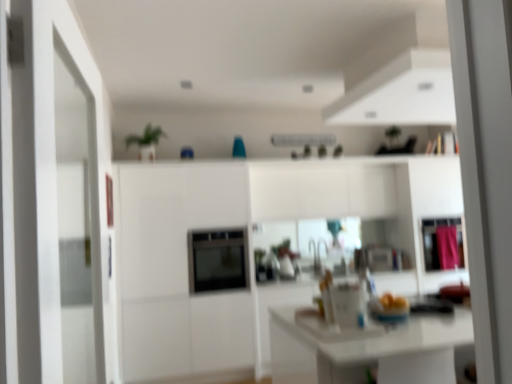
Question: Does satin black oven at center have a smaller size compared to pink fabric curtain at right?

Choices:
 (A) yes
 (B) no

Answer: (B)

Question: From the image's perspective, would you say satin black oven at center is shown under pink fabric curtain at right?

Choices:
 (A) yes
 (B) no

Answer: (A)

Question: Is satin black oven at center positioned behind pink fabric curtain at right?

Choices:
 (A) yes
 (B) no

Answer: (B)

Question: Does satin black oven at center have a lesser width compared to pink fabric curtain at right?

Choices:
 (A) yes
 (B) no

Answer: (B)

Question: Is satin black oven at center positioned before pink fabric curtain at right?

Choices:
 (A) no
 (B) yes

Answer: (B)

Question: From a real-world perspective, is satin black oven at center positioned over pink fabric curtain at right based on gravity?

Choices:
 (A) yes
 (B) no

Answer: (A)

Question: Considering the relative sizes of satin black oven at center and pink fabric cabinet at right in the image provided, is satin black oven at center wider than pink fabric cabinet at right?

Choices:
 (A) yes
 (B) no

Answer: (A)

Question: Is satin black oven at center further to camera compared to pink fabric cabinet at right?

Choices:
 (A) no
 (B) yes

Answer: (A)

Question: Does satin black oven at center contain pink fabric cabinet at right?

Choices:
 (A) no
 (B) yes

Answer: (A)

Question: Is satin black oven at center at the left side of pink fabric cabinet at right?

Choices:
 (A) yes
 (B) no

Answer: (A)

Question: Is satin black oven at center bigger than pink fabric cabinet at right?

Choices:
 (A) no
 (B) yes

Answer: (B)

Question: Considering the relative sizes of satin black oven at center and pink fabric cabinet at right in the image provided, is satin black oven at center thinner than pink fabric cabinet at right?

Choices:
 (A) yes
 (B) no

Answer: (B)

Question: Is pink fabric curtain at right at the left side of satin black oven at center?

Choices:
 (A) yes
 (B) no

Answer: (B)